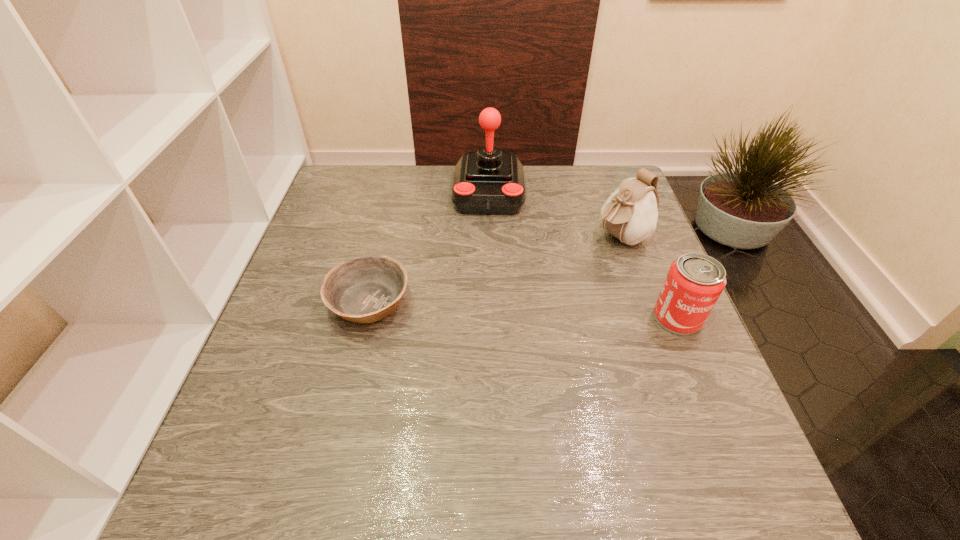
Locate an element on the screen. free location at the right edge is located at coordinates (627, 249).

Locate an element on the screen. vacant space at the near left corner of the desktop is located at coordinates tap(219, 440).

You are a GUI agent. You are given a task and a screenshot of the screen. Output one action in this format:
    pyautogui.click(x=<x>, y=<y>)
    Task: Click on the vacant space at the near right corner
    This screenshot has height=540, width=960.
    Given the screenshot: What is the action you would take?
    pyautogui.click(x=662, y=411)

You are a GUI agent. You are given a task and a screenshot of the screen. Output one action in this format:
    pyautogui.click(x=<x>, y=<y>)
    Task: Click on the vacant space in between the second shortest object and the shortest object
    
    Given the screenshot: What is the action you would take?
    pyautogui.click(x=523, y=310)

What are the coordinates of `free area in between the tallest object and the second shortest object` in the screenshot? It's located at click(583, 255).

Find the location of a particular element. Image resolution: width=960 pixels, height=540 pixels. free area in between the shortest object and the can is located at coordinates (523, 310).

Find the location of a particular element. blank region between the third object from right to left and the shortest object is located at coordinates (429, 248).

You are a GUI agent. You are given a task and a screenshot of the screen. Output one action in this format:
    pyautogui.click(x=<x>, y=<y>)
    Task: Click on the free space between the shortest object and the joystick
    The width and height of the screenshot is (960, 540).
    Given the screenshot: What is the action you would take?
    pyautogui.click(x=429, y=248)

Locate an element on the screen. The width and height of the screenshot is (960, 540). unoccupied area between the bowl and the joystick is located at coordinates (429, 248).

I want to click on free spot between the pouch and the leftmost object, so click(494, 270).